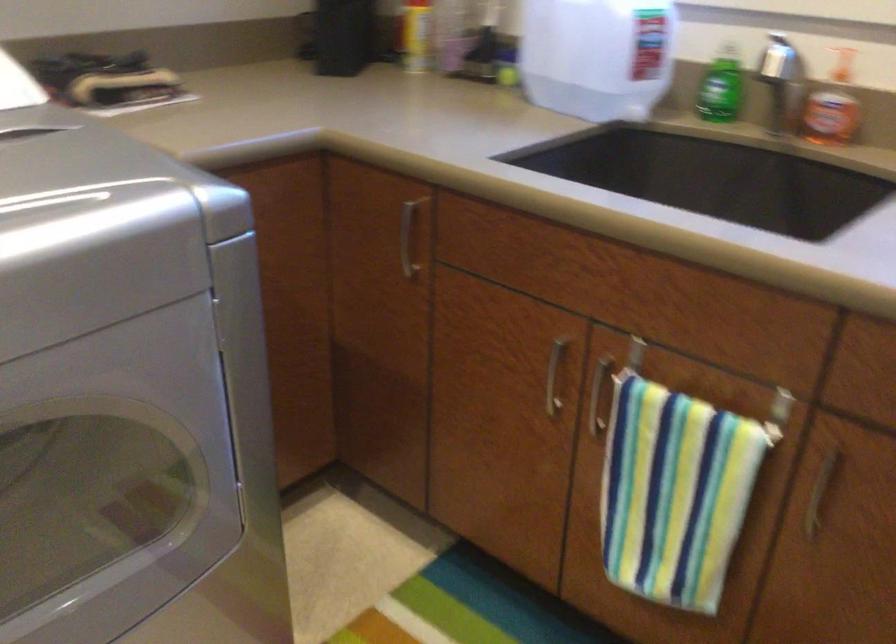
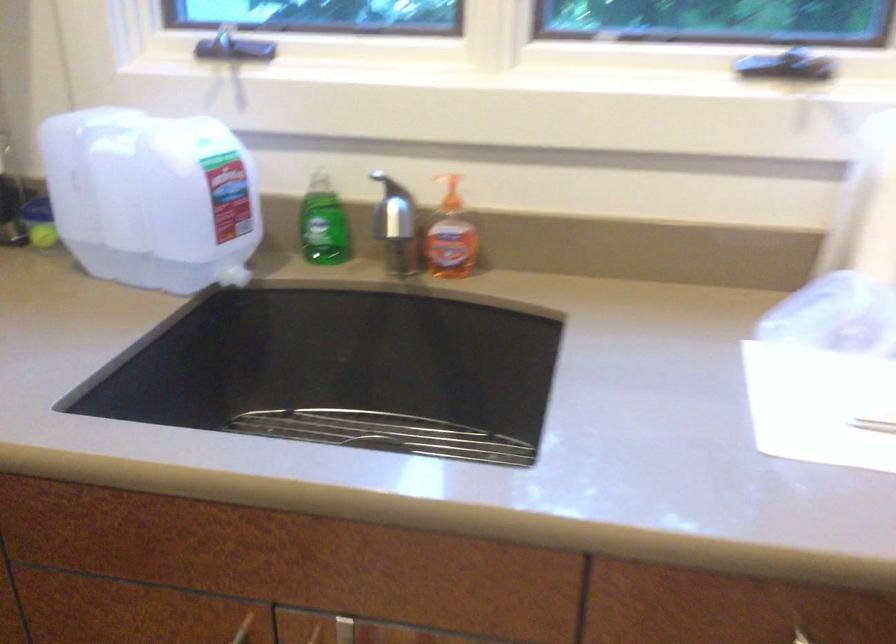
The point at (567, 342) is marked in the first image. Where is the corresponding point in the second image?

(243, 629)